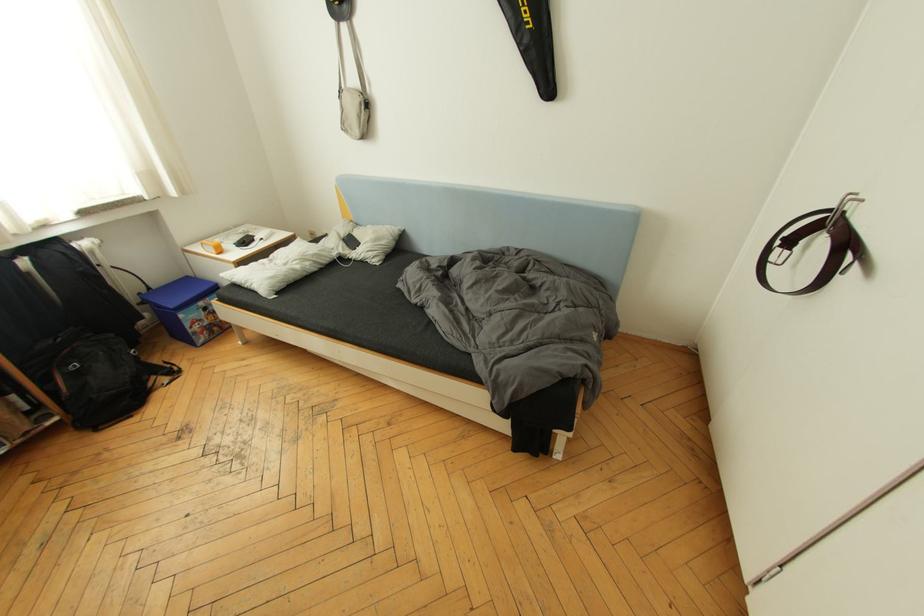
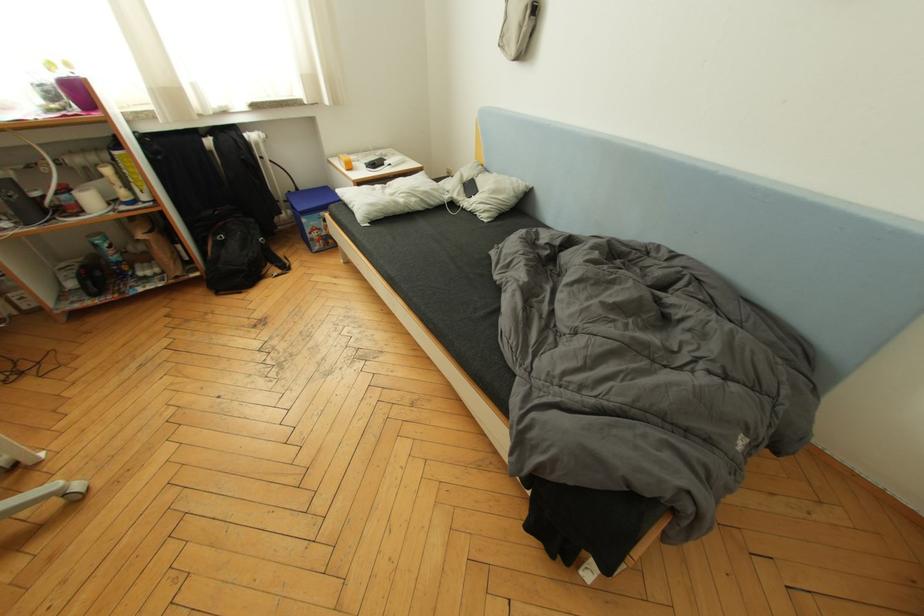
Question: Based on the continuous images, in which direction is the camera rotating? Reply with the corresponding letter.

Choices:
 (A) Left
 (B) Right
 (C) Up
 (D) Down

Answer: (A)